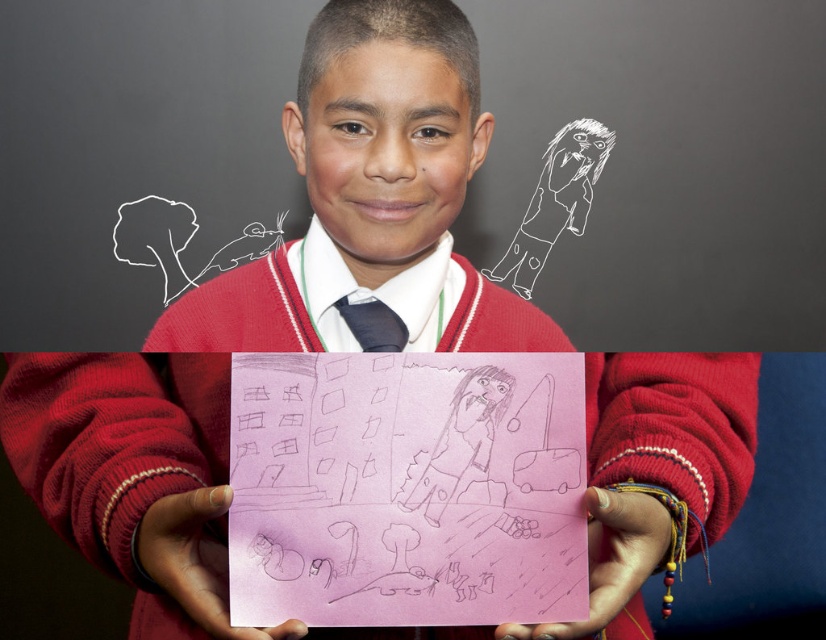
You are a photographer trying to capture the boy holding his drawing. To ensure both the pink paper at center and the black satin tie at center are clearly visible in the photo, where should you position the camera relative to the boy?

The pink paper at center is positioned under the black satin tie at center, so positioning the camera slightly below the boy would allow both the pink paper at center and the black satin tie at center to be visible without one blocking the other.